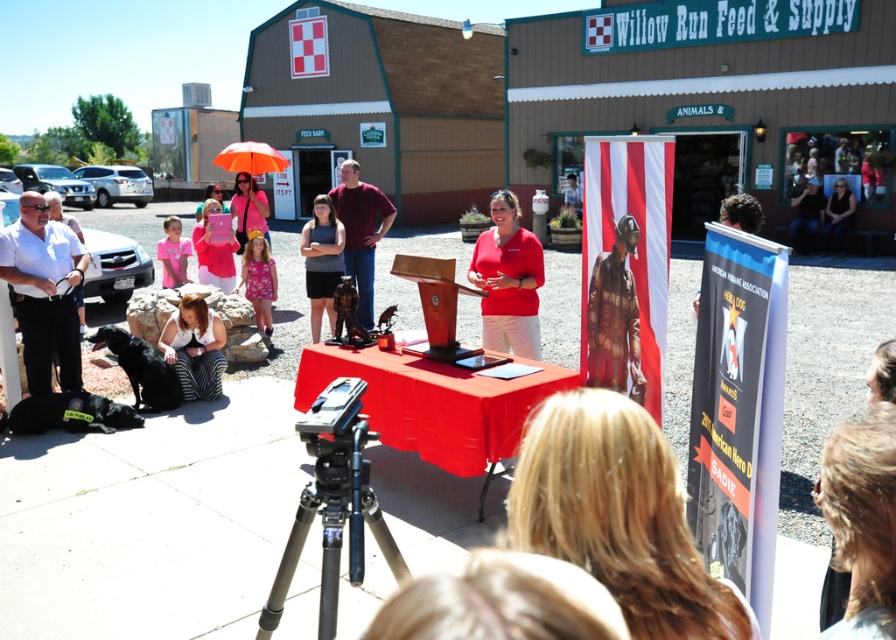
Is maroon fabric shirt at center below orange matte umbrella at upper center?

Yes.

Does point (352, 246) lie behind point (265, 164)?

That is False.

The height and width of the screenshot is (640, 896). I want to click on maroon fabric shirt at center, so pyautogui.click(x=360, y=232).

Is matte red shirt at center wider than gray fabric shirt at center?

Yes.

Between point (489, 234) and point (326, 259), which one is positioned behind?

The point (326, 259) is more distant.

Find the location of a particular element. matte red shirt at center is located at coordinates (507, 280).

Is point (204, 385) farther from camera compared to point (273, 161)?

No, (204, 385) is closer to viewer.

Does matte black dog at lower left have a larger size compared to orange matte umbrella at upper center?

Actually, matte black dog at lower left might be smaller than orange matte umbrella at upper center.

Does point (164, 332) come behind point (226, 164)?

No, it is not.

Identify the location of matte black dog at lower left. The width and height of the screenshot is (896, 640). (194, 348).